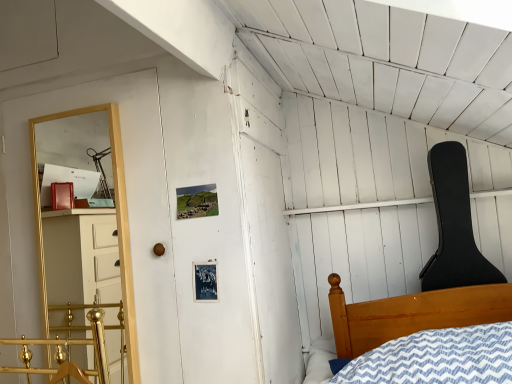
This screenshot has width=512, height=384. What are the coordinates of `gold wooden shelf at left` in the screenshot? It's located at (117, 224).

Consider the image. Measure the distance between point (440, 178) and camera.

Point (440, 178) and camera are 1.87 meters apart.

Image resolution: width=512 pixels, height=384 pixels. I want to click on gold wooden shelf at left, so click(x=117, y=224).

Looking at this image, considering the positions of objects gold metallic rail at lower left and gold wooden shelf at left in the image provided, who is behind, gold metallic rail at lower left or gold wooden shelf at left?

gold wooden shelf at left.

Is gold metallic rail at lower left oriented towards gold wooden shelf at left?

No, gold metallic rail at lower left does not turn towards gold wooden shelf at left.

From the image's perspective, is gold metallic rail at lower left above or below gold wooden shelf at left?

Clearly, from the image's perspective, gold metallic rail at lower left is below gold wooden shelf at left.

Can you confirm if black hard case guitar at upper right is bigger than gold metallic rail at lower left?

Indeed, black hard case guitar at upper right has a larger size compared to gold metallic rail at lower left.

In the scene shown: From a real-world perspective, between black hard case guitar at upper right and gold metallic rail at lower left, who is vertically lower?

gold metallic rail at lower left is physically lower.

How much distance is there between black hard case guitar at upper right and gold metallic rail at lower left?

black hard case guitar at upper right and gold metallic rail at lower left are 5.31 feet apart from each other.

Is gold metallic rail at lower left located within black hard case guitar at upper right?

No, gold metallic rail at lower left is not a part of black hard case guitar at upper right.

Is gold metallic rail at lower left in contact with black hard case guitar at upper right?

No, gold metallic rail at lower left is not next to black hard case guitar at upper right.

How different are the orientations of gold metallic rail at lower left and black hard case guitar at upper right in degrees?

0.828 degrees separate the facing orientations of gold metallic rail at lower left and black hard case guitar at upper right.

Is gold metallic rail at lower left oriented towards black hard case guitar at upper right?

No.

Considering the sizes of objects gold wooden shelf at left and gold metallic rail at lower left in the image provided, who is smaller, gold wooden shelf at left or gold metallic rail at lower left?

Smaller between the two is gold metallic rail at lower left.

Is gold wooden shelf at left at the right side of gold metallic rail at lower left?

No, gold wooden shelf at left is not to the right of gold metallic rail at lower left.

Which is in front, gold wooden shelf at left or gold metallic rail at lower left?

gold metallic rail at lower left is closer to the camera.

Is gold wooden shelf at left shorter than gold metallic rail at lower left?

No, gold wooden shelf at left is not shorter than gold metallic rail at lower left.

How different are the orientations of gold wooden shelf at left and black hard case guitar at upper right in degrees?

They differ by 0.827 degrees in their facing directions.

Which is closer to the camera, (129, 381) or (454, 265)?

Point (129, 381) appears to be closer to the viewer than point (454, 265).

From a real-world perspective, is gold wooden shelf at left under black hard case guitar at upper right?

No, from a real-world perspective, gold wooden shelf at left is not under black hard case guitar at upper right.

Does gold wooden shelf at left have a lesser width compared to black hard case guitar at upper right?

Correct, the width of gold wooden shelf at left is less than that of black hard case guitar at upper right.

Is black hard case guitar at upper right far from gold wooden shelf at left?

Yes, black hard case guitar at upper right is far from gold wooden shelf at left.

What's the angular difference between black hard case guitar at upper right and gold wooden shelf at left's facing directions?

The angle between the facing direction of black hard case guitar at upper right and the facing direction of gold wooden shelf at left is 0.827 degrees.

The image size is (512, 384). I want to click on shelf that appears in front of the black hard case guitar at upper right, so click(x=117, y=224).

Does black hard case guitar at upper right have a lesser height compared to gold wooden shelf at left?

Correct, black hard case guitar at upper right is not as tall as gold wooden shelf at left.

Where is `rail on the right of the gold wooden shelf at left`? rail on the right of the gold wooden shelf at left is located at coordinates (74, 344).

This screenshot has height=384, width=512. I want to click on chair lying behind the gold metallic rail at lower left, so click(x=454, y=225).

Looking at the image, which one is located further to black hard case guitar at upper right, gold metallic rail at lower left or gold wooden shelf at left?

gold metallic rail at lower left is further to black hard case guitar at upper right.

Which object lies nearer to the anchor point gold metallic rail at lower left, gold wooden shelf at left or black hard case guitar at upper right?

gold wooden shelf at left is positioned closer to the anchor gold metallic rail at lower left.

From the image, which object appears to be nearer to gold metallic rail at lower left, black hard case guitar at upper right or gold wooden shelf at left?

gold wooden shelf at left is closer to gold metallic rail at lower left.

Which object lies further to the anchor point black hard case guitar at upper right, gold wooden shelf at left or gold metallic rail at lower left?

The object further to black hard case guitar at upper right is gold metallic rail at lower left.

Estimate the real-world distances between objects in this image. Which object is closer to gold wooden shelf at left, gold metallic rail at lower left or black hard case guitar at upper right?

Among the two, gold metallic rail at lower left is located nearer to gold wooden shelf at left.

Which object lies nearer to the anchor point gold wooden shelf at left, black hard case guitar at upper right or gold metallic rail at lower left?

gold metallic rail at lower left.

Find the location of a particular element. This screenshot has height=384, width=512. rail situated between gold wooden shelf at left and black hard case guitar at upper right from left to right is located at coordinates (74, 344).